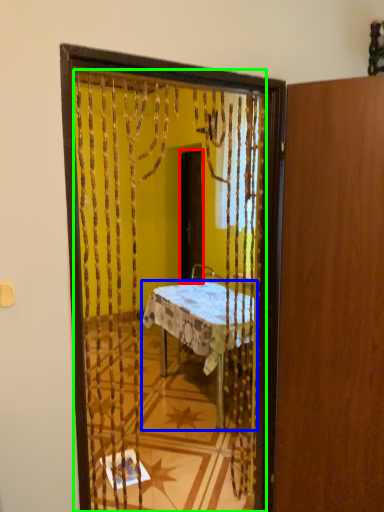
Question: Which is farther away from screen door (highlighted by a red box)? desk (highlighted by a blue box) or mirror (highlighted by a green box)?

Choices:
 (A) desk
 (B) mirror

Answer: (B)